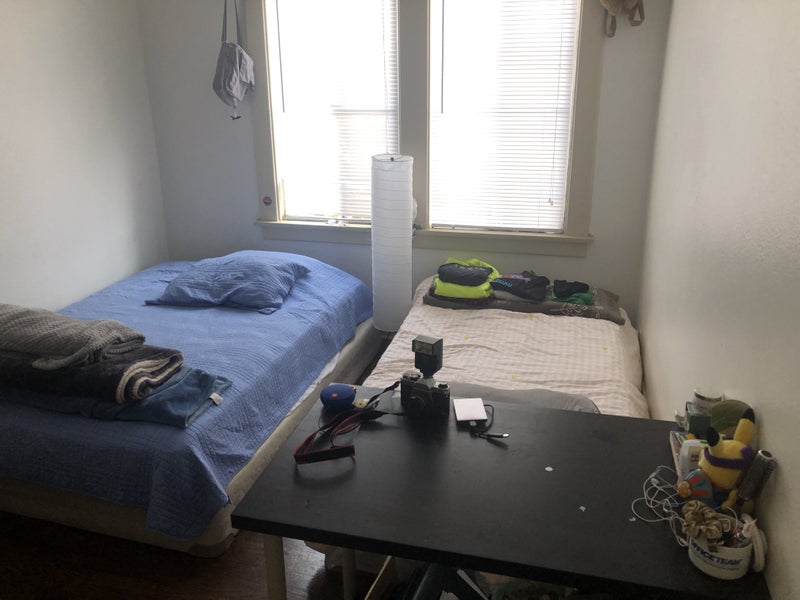
This screenshot has width=800, height=600. What are the coordinates of `windows` in the screenshot? It's located at (349, 127), (524, 139).